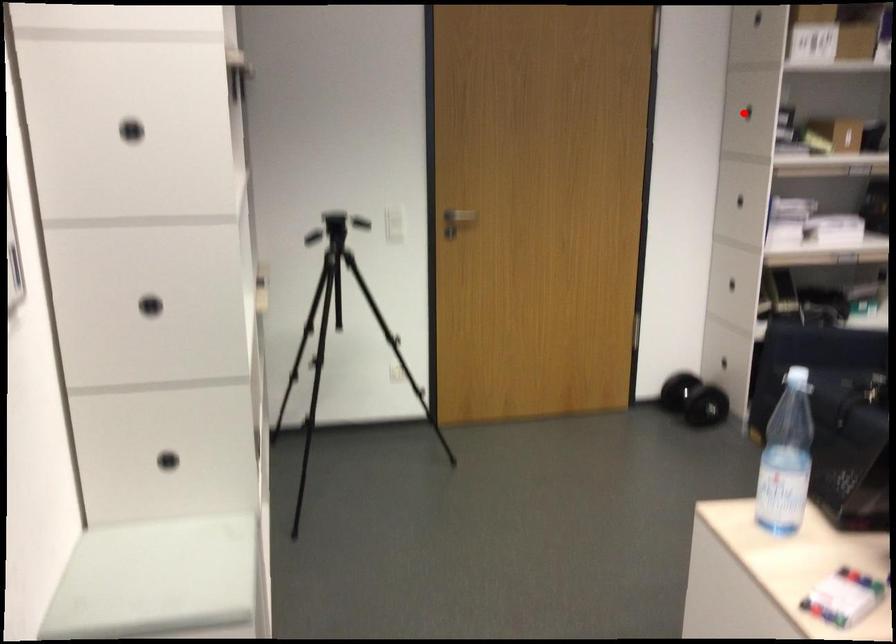
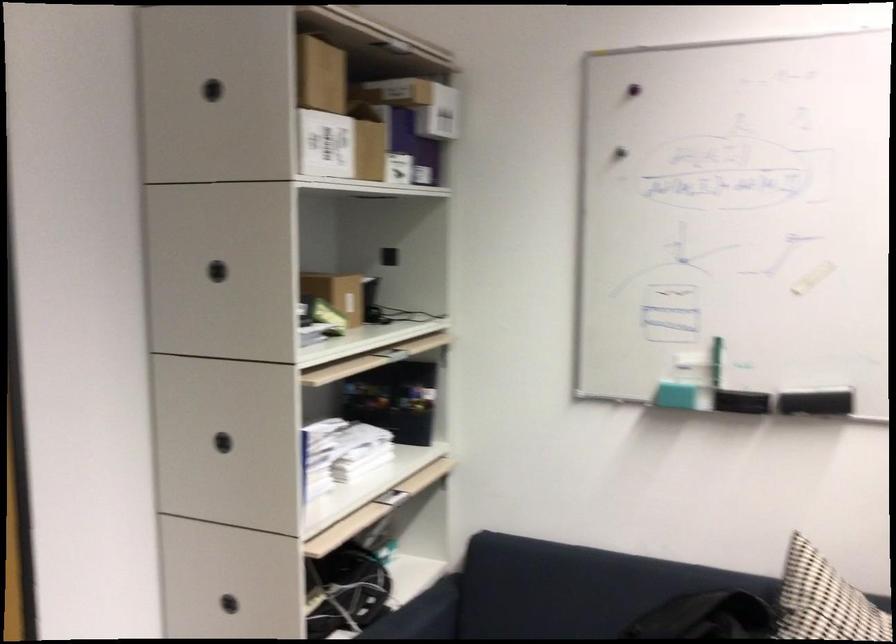
Question: I am providing you with two images of the same scene from different viewpoints. Image1 has a red point marked. In image2, the corresponding 3D location appears at what relative position? Reply with the corresponding letter.

Choices:
 (A) Closer
 (B) Farther

Answer: (A)